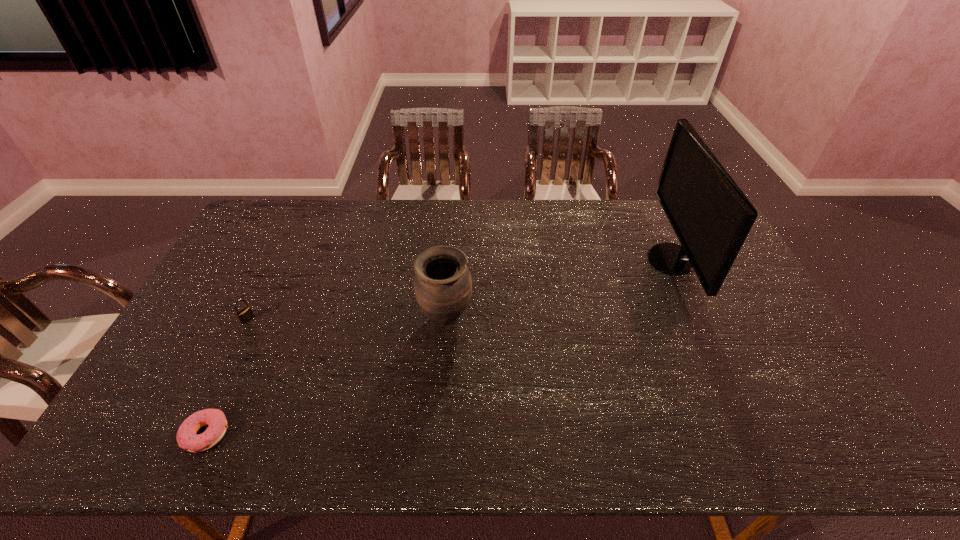
Find the location of a particular element. free location at the far edge of the desktop is located at coordinates (405, 211).

Identify the location of vacant space at the near edge of the desktop. This screenshot has width=960, height=540. (425, 456).

Locate an element on the screen. The height and width of the screenshot is (540, 960). vacant space at the left edge of the desktop is located at coordinates (190, 321).

Image resolution: width=960 pixels, height=540 pixels. In order to click on vacant space at the right edge in this screenshot , I will do `click(775, 327)`.

Where is `free region at the far right corner of the desktop`? The width and height of the screenshot is (960, 540). free region at the far right corner of the desktop is located at coordinates (674, 233).

Image resolution: width=960 pixels, height=540 pixels. I want to click on vacant region between the second shortest object and the third shortest object, so click(x=347, y=319).

Find the location of a particular element. The image size is (960, 540). vacant point located between the tallest object and the doughnut is located at coordinates (439, 347).

You are a GUI agent. You are given a task and a screenshot of the screen. Output one action in this format:
    pyautogui.click(x=<x>, y=<y>)
    Task: Click on the vacant area that lies between the third object from left to right and the doughnut
    This screenshot has width=960, height=540.
    Given the screenshot: What is the action you would take?
    pyautogui.click(x=325, y=376)

The image size is (960, 540). Find the location of `empty space that is in between the urn and the doughnut`. empty space that is in between the urn and the doughnut is located at coordinates (325, 376).

You are a GUI agent. You are given a task and a screenshot of the screen. Output one action in this format:
    pyautogui.click(x=<x>, y=<y>)
    Task: Click on the vacant area between the urn and the rightmost object
    This screenshot has height=540, width=960.
    Given the screenshot: What is the action you would take?
    pyautogui.click(x=559, y=288)